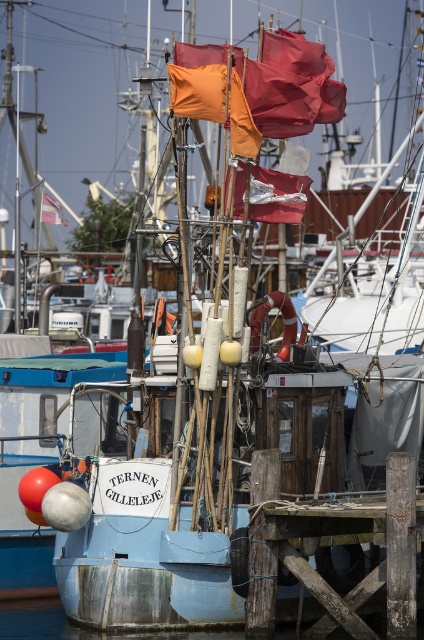
Does orange fabric flags at upper center appear on the left side of shiny silver flag at center?

Correct, you'll find orange fabric flags at upper center to the left of shiny silver flag at center.

Is orange fabric flags at upper center taller than shiny silver flag at center?

Correct, orange fabric flags at upper center is much taller as shiny silver flag at center.

Where is `orange fabric flags at upper center`? orange fabric flags at upper center is located at coordinates (278, 81).

Does weathered wood dock at lower right have a lesser height compared to orange fabric flags at upper center?

Incorrect, weathered wood dock at lower right's height does not fall short of orange fabric flags at upper center's.

Is point (295, 506) more distant than point (343, 108)?

No, (295, 506) is closer to viewer.

You are a GUI agent. You are given a task and a screenshot of the screen. Output one action in this format:
    pyautogui.click(x=<x>, y=<y>)
    Task: Click on the weathered wood dock at lower right
    Image resolution: width=424 pixels, height=640 pixels.
    Given the screenshot: What is the action you would take?
    pyautogui.click(x=334, y=538)

Between point (273, 198) and point (44, 204), which one is positioned behind?

The point (44, 204) is behind.

Does shiny silver flag at center have a lesser width compared to orange fabric flag at upper center?

Indeed, shiny silver flag at center has a lesser width compared to orange fabric flag at upper center.

Does point (242, 170) come behind point (64, 220)?

No, (242, 170) is in front of (64, 220).

Locate an element on the screen. This screenshot has height=640, width=424. shiny silver flag at center is located at coordinates (276, 195).